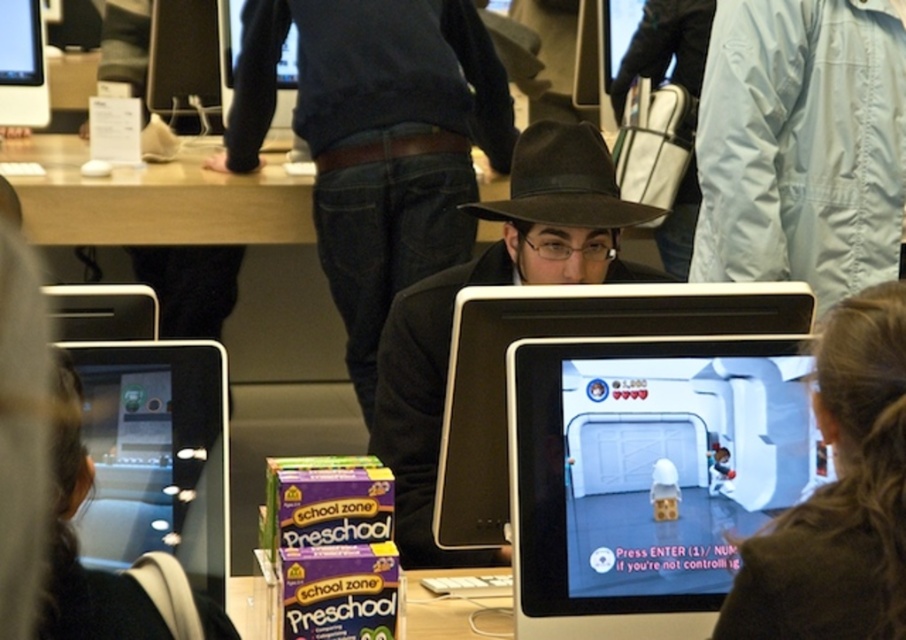
Which is below, light blue fabric jacket at center or brown felt cowboy hat at center?

Positioned lower is brown felt cowboy hat at center.

Does light blue fabric jacket at center come behind brown felt cowboy hat at center?

That is True.

What do you see at coordinates (801, 145) in the screenshot? This screenshot has height=640, width=906. I see `light blue fabric jacket at center` at bounding box center [801, 145].

Image resolution: width=906 pixels, height=640 pixels. In order to click on light blue fabric jacket at center in this screenshot , I will do `click(801, 145)`.

In order to click on brown leather jacket at center in this screenshot , I will do `click(839, 497)`.

Does black glossy tablet at left appear on the left side of brown felt cowboy hat at center?

Indeed, black glossy tablet at left is positioned on the left side of brown felt cowboy hat at center.

Does point (94, 392) come closer to viewer compared to point (570, 147)?

That is True.

Does point (162, 538) come farther from viewer compared to point (516, 198)?

No, it is in front of (516, 198).

I want to click on black glossy tablet at left, so click(155, 456).